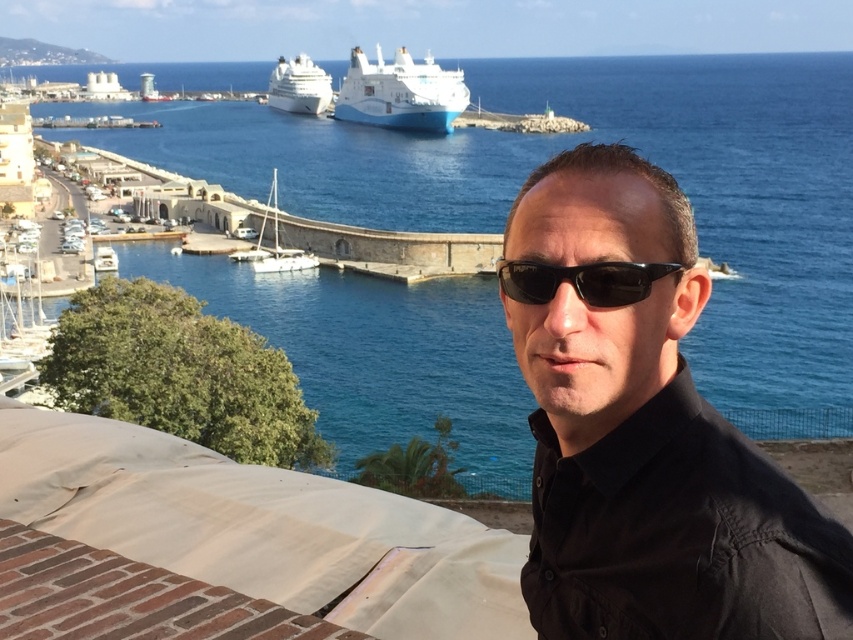
Does black matte shirt at center come in front of white glossy cruise ship at center?

Yes, black matte shirt at center is closer to the viewer.

Can you confirm if black matte shirt at center is positioned to the right of white glossy cruise ship at center?

Indeed, black matte shirt at center is positioned on the right side of white glossy cruise ship at center.

Between point (648, 609) and point (368, 92), which one is positioned behind?

The point (368, 92) is behind.

Identify the location of black matte shirt at center. (645, 429).

Does blue water at center appear on the right side of white glossy cruise ship at upper center?

Indeed, blue water at center is positioned on the right side of white glossy cruise ship at upper center.

Is blue water at center further to the viewer compared to white glossy cruise ship at upper center?

No, it is in front of white glossy cruise ship at upper center.

Is point (131, 84) farther from viewer compared to point (268, 96)?

That is True.

You are a GUI agent. You are given a task and a screenshot of the screen. Output one action in this format:
    pyautogui.click(x=<x>, y=<y>)
    Task: Click on the blue water at center
    The height and width of the screenshot is (640, 853).
    Given the screenshot: What is the action you would take?
    pyautogui.click(x=596, y=140)

Which is below, black matte shirt at center or white glossy cruise ship at upper center?

Positioned lower is black matte shirt at center.

Does black matte shirt at center have a lesser width compared to white glossy cruise ship at upper center?

Correct, black matte shirt at center's width is less than white glossy cruise ship at upper center's.

Locate an element on the screen. The width and height of the screenshot is (853, 640). black matte shirt at center is located at coordinates (645, 429).

The image size is (853, 640). In order to click on black matte shirt at center in this screenshot , I will do `click(645, 429)`.